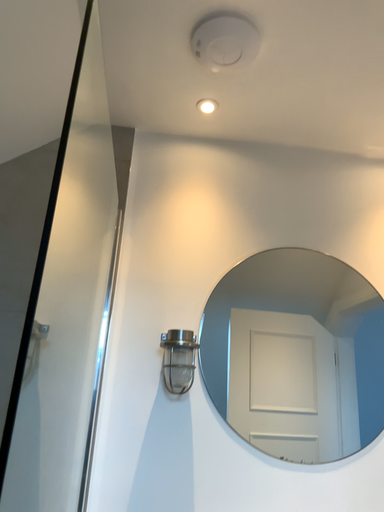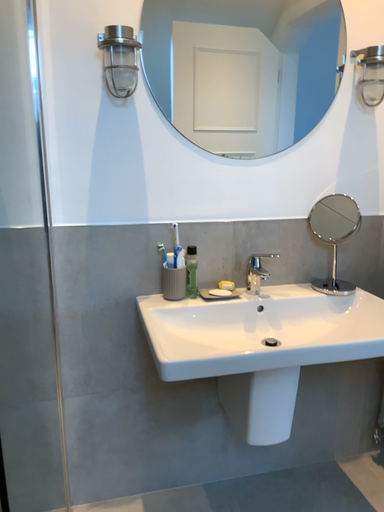
Question: Which way did the camera rotate in the video?

Choices:
 (A) rotated right
 (B) rotated left

Answer: (A)